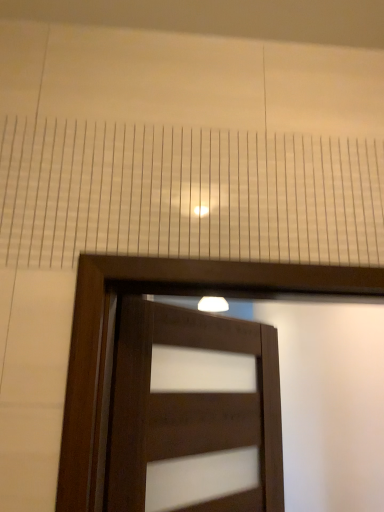
The height and width of the screenshot is (512, 384). What do you see at coordinates (190, 406) in the screenshot?
I see `matte brown door at center` at bounding box center [190, 406].

Locate an element on the screen. The width and height of the screenshot is (384, 512). matte brown door at center is located at coordinates (190, 406).

This screenshot has width=384, height=512. I want to click on matte brown door at center, so click(190, 406).